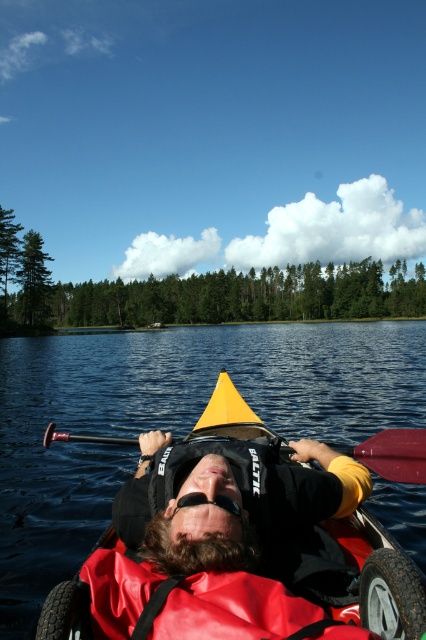
You are a photographer trying to capture the kayaker in the image. You need to decide which object, the black matte life vest at center or the red plastic paddle at center, will appear larger in your photo. Which one should you focus on to ensure it takes up more space in the frame?

The black matte life vest at center is bigger than the red plastic paddle at center, so focusing on the black matte life vest at center will ensure it takes up more space in the frame.

Looking at this image, you are a photographer trying to capture the reflection of the red plastic paddle at center in the transparent water at center. Based on the scene, will the paddle be fully visible in the water?

The transparent water at center is larger in size than red plastic paddle at center, so the paddle will be fully visible in the water.

You are a lifeguard on duty and need to ensure the safety of the person in the kayak. The black matte life vest at center and the black rubber goggles at center are both essential safety items. Based on the distance between them, can you confirm if the person can easily reach both items while maintaining a safe position?

The distance between the black matte life vest at center and the black rubber goggles at center is 21.16 inches. Since this distance is manageable for an average person to reach comfortably, the individual can easily access both items while staying in a safe position.